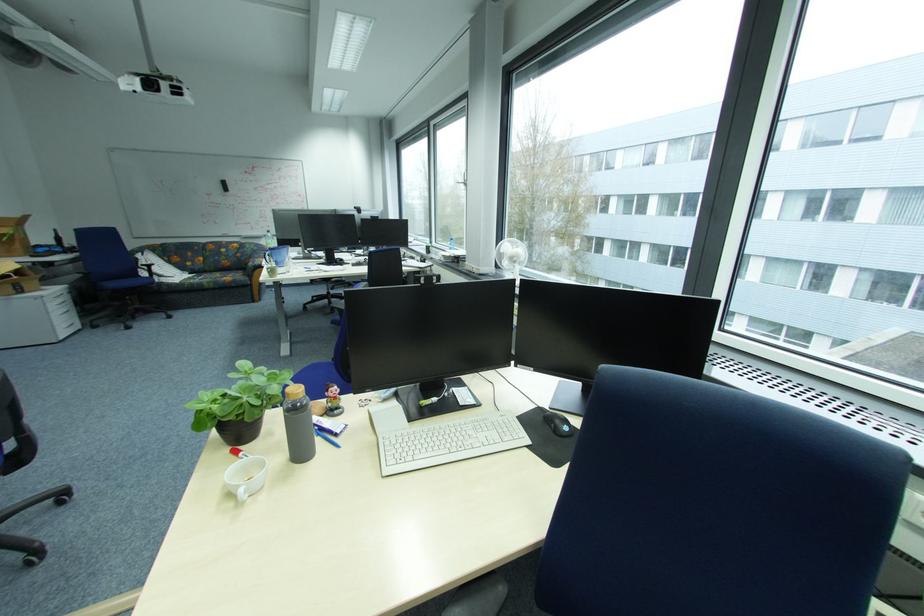
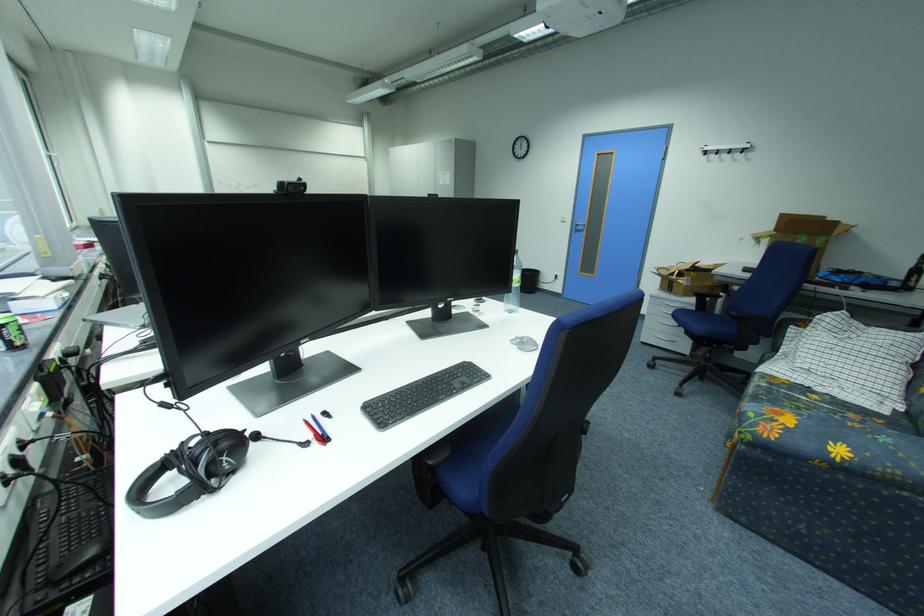
Question: I am providing you with two images of the same scene from different viewpoints. Which of the following objects are not visible in image2?

Choices:
 (A) clear water bottle
 (B) grey water bottle
 (C) paper towel roll
 (D) silver computer mouse

Answer: (B)